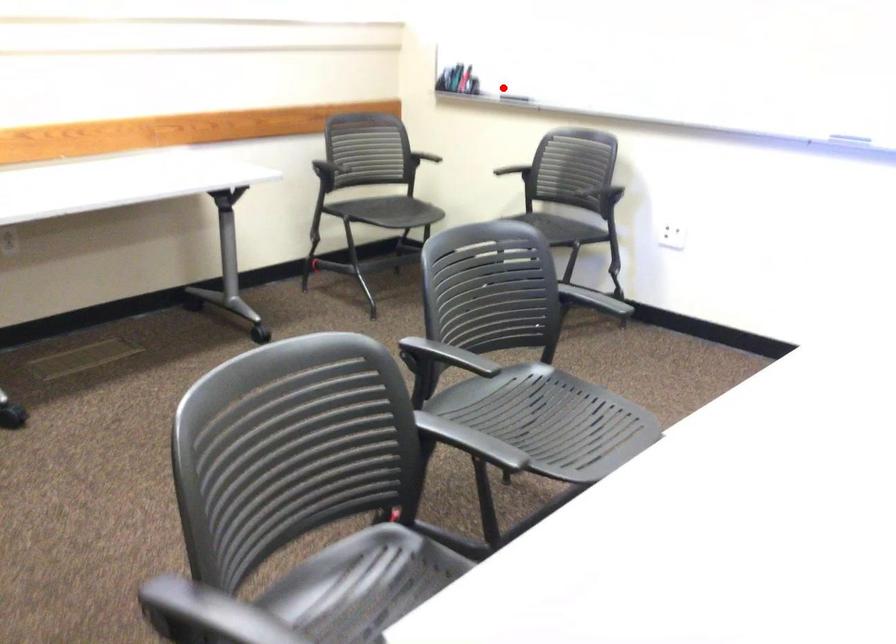
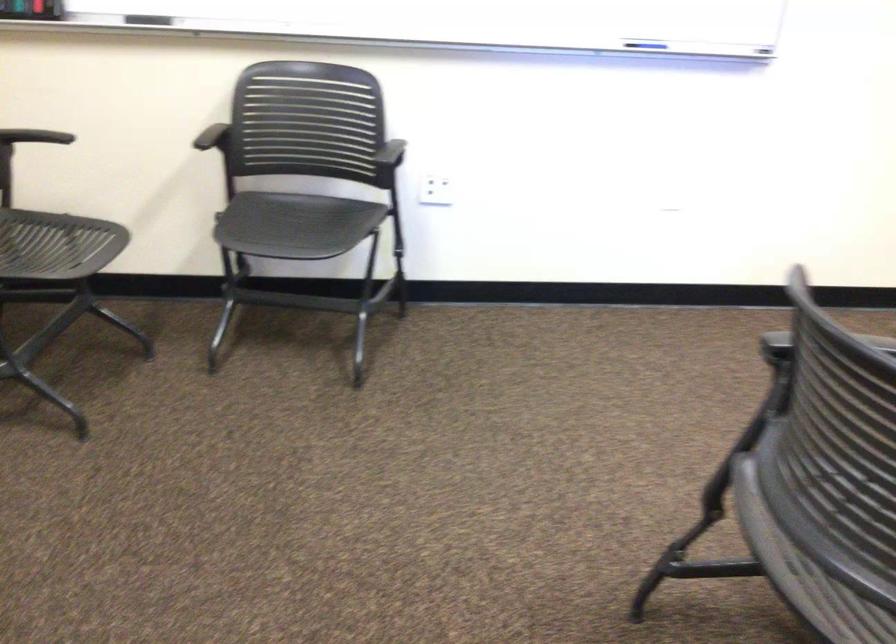
The point at the highlighted location is marked in the first image. Where is the corresponding point in the second image?

(148, 20)